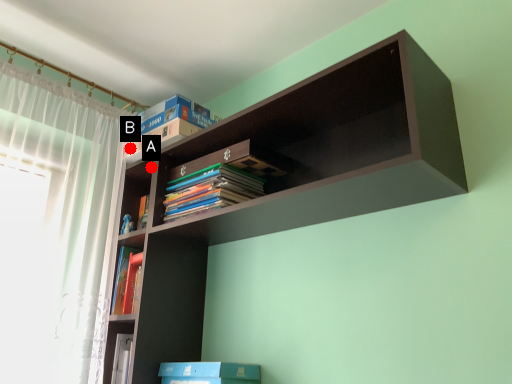
Question: Two points are circled on the image, labeled by A and B beside each circle. Which point is farther to the camera?

Choices:
 (A) A is further
 (B) B is further

Answer: (A)